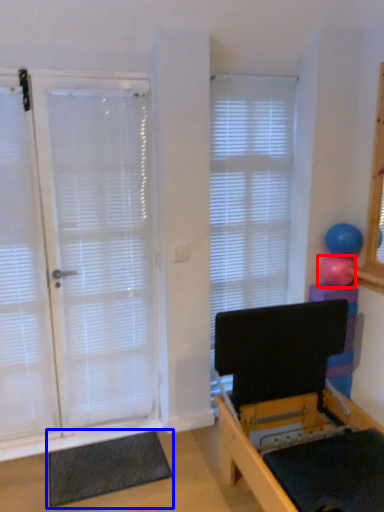
Question: Which point is closer to the camera, ball (highlighted by a red box) or yoga mat (highlighted by a blue box)?

Choices:
 (A) ball
 (B) yoga mat

Answer: (B)